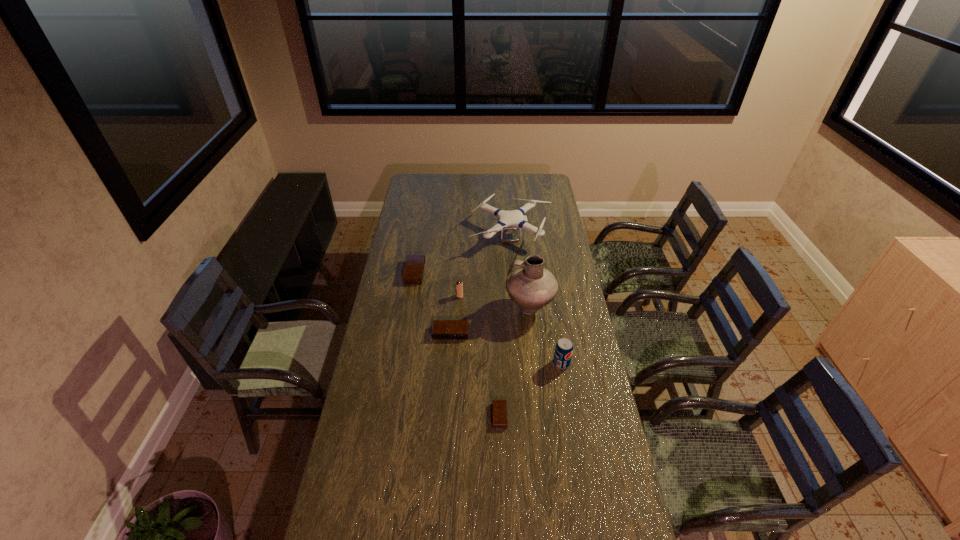
Where is `object that ranks as the second closest to the second alarm clock from right to left`? This screenshot has height=540, width=960. object that ranks as the second closest to the second alarm clock from right to left is located at coordinates (459, 285).

Image resolution: width=960 pixels, height=540 pixels. In order to click on the fifth closest object to the sixth farthest object in this screenshot , I will do `click(516, 217)`.

Locate an element on the screen. alarm clock that is the second closest one to the tallest object is located at coordinates (499, 407).

Identify which alarm clock is the nearest to the second nearest object. Please provide its 2D coordinates. Your answer should be formatted as a tuple, i.e. [(x, y)], where the tuple contains the x and y coordinates of a point satisfying the conditions above.

[(499, 407)]

The width and height of the screenshot is (960, 540). Find the location of `free location that satisfies the following two spatial constraints: 1. on the handle side of the pop; 2. on the left side of the pitcher`. free location that satisfies the following two spatial constraints: 1. on the handle side of the pop; 2. on the left side of the pitcher is located at coordinates (536, 363).

You are a GUI agent. You are given a task and a screenshot of the screen. Output one action in this format:
    pyautogui.click(x=<x>, y=<y>)
    Task: Click on the vacant area in the image that satisfies the following two spatial constraints: 1. on the front side of the drone; 2. on the front face of the leftmost object
    The height and width of the screenshot is (540, 960).
    Given the screenshot: What is the action you would take?
    pyautogui.click(x=514, y=272)

The height and width of the screenshot is (540, 960). I want to click on vacant space that satisfies the following two spatial constraints: 1. on the front face of the leftmost object; 2. on the right side of the igniter, so click(x=411, y=296).